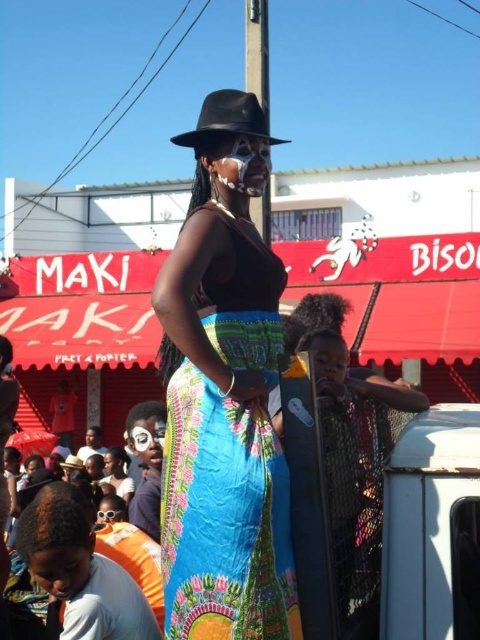
You are a photographer trying to capture the central figure in the scene. You notice the matte black hat at center and the black felt fedora at upper center. Which object is closer to the camera?

The matte black hat at center is closer to the camera because it is in front of the black felt fedora at upper center.